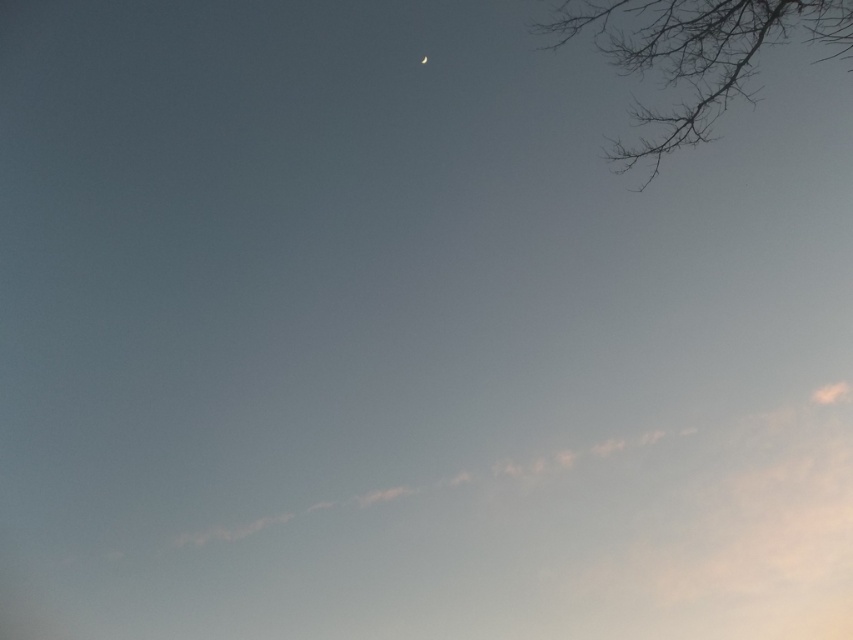
You are standing in a field looking at the sky scene described. There is a point at coordinates point (695, 52). What object is located at that point?

The point (695, 52) is where dark gray branches at upper right are located.

You are an astronomer observing the sky scene. You notice the dark gray branches at upper right and the silver metallic crescent moon at upper center. Which object appears wider in the image?

The dark gray branches at upper right might be wider than the silver metallic crescent moon at upper center according to the description.